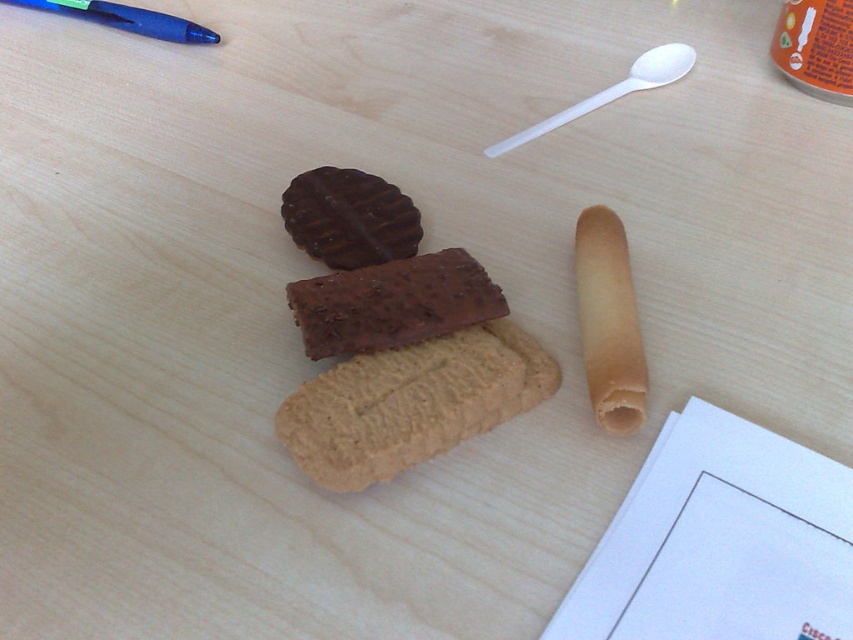
Question: Considering the real-world distances, which object is farthest from the beige matte rolling pin at center-right?

Choices:
 (A) golden textured cookie at center
 (B) white plastic spoon at upper center
 (C) chocolatesmoothbar at center
 (D) blue plastic pen at upper left

Answer: (D)

Question: Can you confirm if beige matte rolling pin at center-right is positioned below blue plastic pen at upper left?

Choices:
 (A) no
 (B) yes

Answer: (B)

Question: Based on their relative distances, which object is farther from the golden textured cookie at center?

Choices:
 (A) chocolate matte cookie at upper center
 (B) white plastic spoon at upper center

Answer: (B)

Question: Which of the following is the farthest from the observer?

Choices:
 (A) pos(136,13)
 (B) pos(613,212)
 (C) pos(669,65)
 (D) pos(393,221)

Answer: (A)

Question: Does golden textured cookie at center come behind chocolate matte cookie at upper center?

Choices:
 (A) no
 (B) yes

Answer: (A)

Question: Is white plastic spoon at upper center bigger than blue plastic pen at upper left?

Choices:
 (A) no
 (B) yes

Answer: (B)